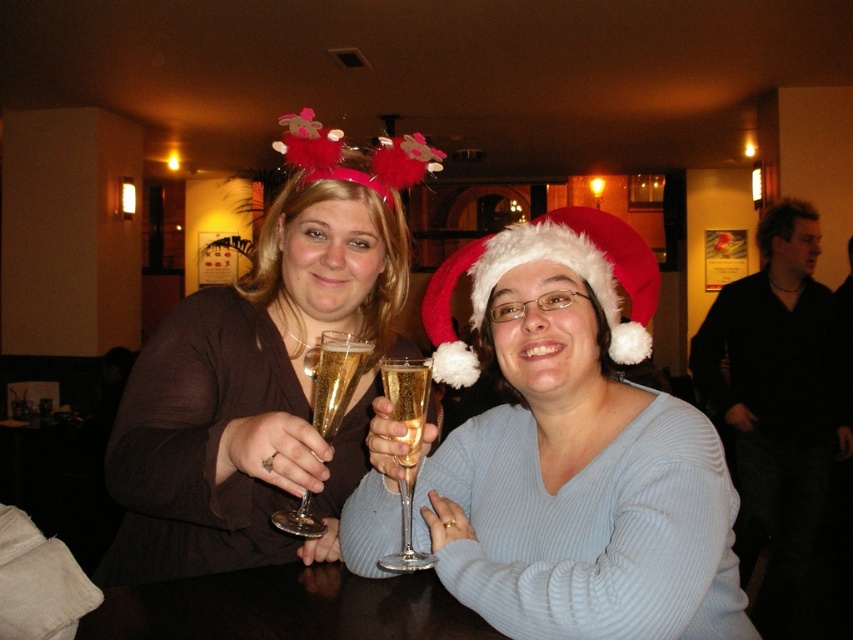
Who is positioned more to the left, white fluffy santa hat at center or translucent glass champagne at center?

translucent glass champagne at center is more to the left.

Who is more forward, [474,369] or [413,376]?

Positioned in front is point [413,376].

I want to click on white fluffy santa hat at center, so click(553, 260).

Does matte black dress at center appear under clear glass champagne flute at center?

No, matte black dress at center is not below clear glass champagne flute at center.

Between point (349, 225) and point (314, 396), which one is positioned behind?

Positioned behind is point (349, 225).

Where is `matte black dress at center`? matte black dress at center is located at coordinates (263, 374).

Is clear glass champagne flute at center wider than clear glass wine glass at center?

Yes.

Who is lower down, clear glass champagne flute at center or clear glass wine glass at center?

Positioned lower is clear glass wine glass at center.

Who is more distant from viewer, [343,380] or [393,564]?

The point [343,380] is more distant.

Where is `clear glass champagne flute at center`? The width and height of the screenshot is (853, 640). clear glass champagne flute at center is located at coordinates (334, 378).